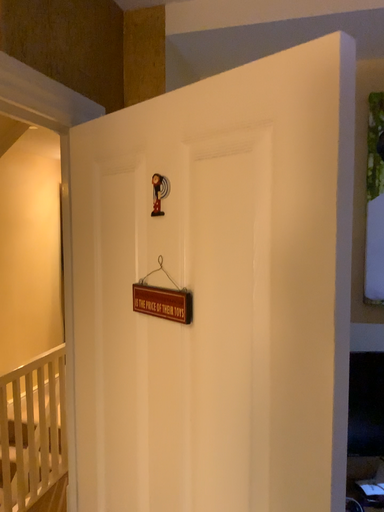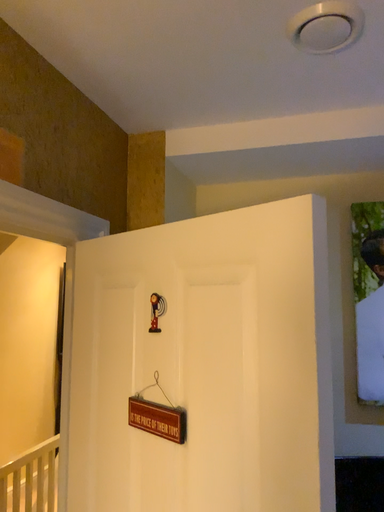
Question: Which way did the camera rotate in the video?

Choices:
 (A) rotated upward
 (B) rotated downward

Answer: (A)